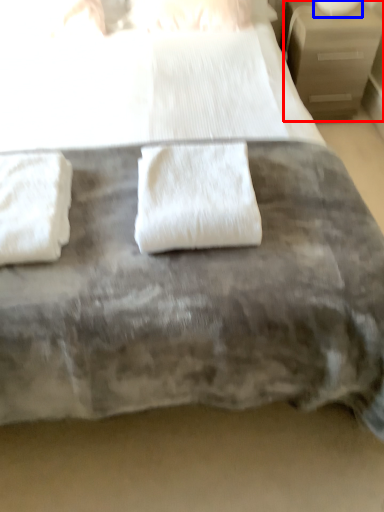
Question: Which of the following is the closest to the observer, nightstand (highlighted by a red box) or table lamp (highlighted by a blue box)?

Choices:
 (A) nightstand
 (B) table lamp

Answer: (A)